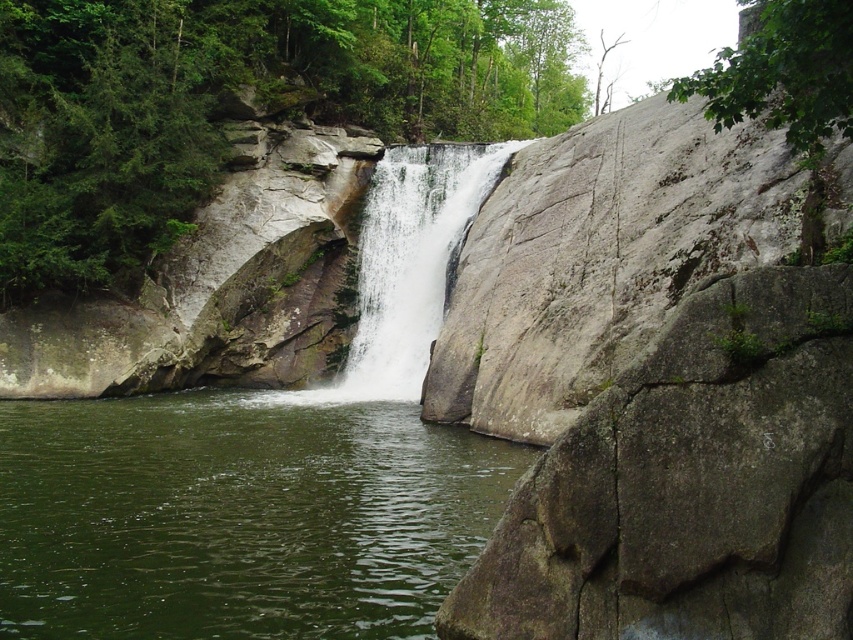
You are a hiker trying to cross the water body. You see the gray rough rock at right and the white smooth waterfall at center. Which object is a better stepping stone for crossing?

The gray rough rock at right is smaller than the white smooth waterfall at center, so the white smooth waterfall at center is larger and more stable for stepping on while crossing the water body.

You are a drone operator trying to capture the waterfall from above. The green liquid water at center is your main focus. Based on its 2D coordinates, which quadrant of the image would you adjust your camera to focus on? The image is divided into four quadrants labeled from left to right, top to bottom as 1 to 4.

The green liquid water at center is located at coordinates (238, 515). Since the x coordinate is 0.806, which is closer to the right edge, and the y coordinate is 0.280, closer to the top edge, it falls in quadrant 1. Adjust your camera to focus on quadrant 1.